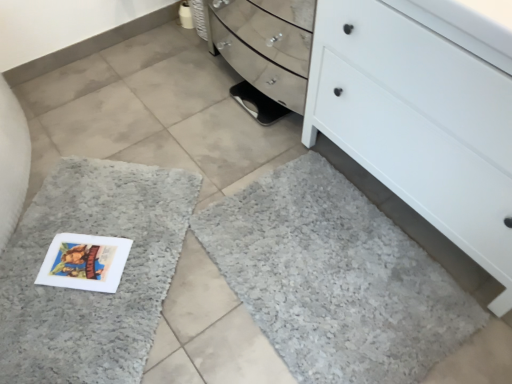
Where is `black rubber shoe at center`? Image resolution: width=512 pixels, height=384 pixels. black rubber shoe at center is located at coordinates pos(258,104).

The image size is (512, 384). Describe the element at coordinates (335, 278) in the screenshot. I see `gray shaggy bath mat at lower right, the second bath mat when ordered from left to right` at that location.

What are the coordinates of `gray shaggy bath mat at lower left, which is the second bath mat from right to left` in the screenshot? It's located at point(91,291).

Can you tell me how much gray shaggy bath mat at lower left, marked as the first bath mat in a left-to-right arrangement, and gray shaggy bath mat at lower right, the second bath mat when ordered from left to right, differ in facing direction?

gray shaggy bath mat at lower left, marked as the first bath mat in a left-to-right arrangement, and gray shaggy bath mat at lower right, the second bath mat when ordered from left to right, are facing 132 degrees away from each other.

Does point (180, 241) come behind point (349, 266)?

Yes, it is.

From the image's perspective, is gray shaggy bath mat at lower left, which is the second bath mat from right to left, above or below gray shaggy bath mat at lower right, the second bath mat when ordered from left to right?

From the image's perspective, gray shaggy bath mat at lower left, which is the second bath mat from right to left, appears above gray shaggy bath mat at lower right, the second bath mat when ordered from left to right.

Can you confirm if gray shaggy bath mat at lower left, marked as the first bath mat in a left-to-right arrangement, is taller than gray shaggy bath mat at lower right, the second bath mat when ordered from left to right?

Correct, gray shaggy bath mat at lower left, marked as the first bath mat in a left-to-right arrangement, is much taller as gray shaggy bath mat at lower right, the second bath mat when ordered from left to right.

Do you think gray shaggy bath mat at lower right, the second bath mat when ordered from left to right, is within gray shaggy bath mat at lower left, marked as the first bath mat in a left-to-right arrangement, or outside of it?

gray shaggy bath mat at lower right, the second bath mat when ordered from left to right, is not inside gray shaggy bath mat at lower left, marked as the first bath mat in a left-to-right arrangement, it's outside.

Is gray shaggy bath mat at lower right, the 1th bath mat viewed from the right, closer to the viewer compared to gray shaggy bath mat at lower left, marked as the first bath mat in a left-to-right arrangement?

That is True.

From the image's perspective, between gray shaggy bath mat at lower right, the second bath mat when ordered from left to right, and gray shaggy bath mat at lower left, which is the second bath mat from right to left, who is located below?

gray shaggy bath mat at lower right, the second bath mat when ordered from left to right, is shown below in the image.

Considering the points (419, 290) and (29, 299), which point is behind, point (419, 290) or point (29, 299)?

The point (419, 290) is behind.

From the image's perspective, is gray shaggy bath mat at lower left, which is the second bath mat from right to left, over white matte chest of drawers at lower right?

No.

Considering the relative sizes of gray shaggy bath mat at lower left, which is the second bath mat from right to left, and white matte chest of drawers at lower right in the image provided, is gray shaggy bath mat at lower left, which is the second bath mat from right to left, taller than white matte chest of drawers at lower right?

In fact, gray shaggy bath mat at lower left, which is the second bath mat from right to left, may be shorter than white matte chest of drawers at lower right.

Does gray shaggy bath mat at lower left, which is the second bath mat from right to left, have a greater width compared to white matte chest of drawers at lower right?

Yes.

Looking at this image, from a real-world perspective, relative to white matte chest of drawers at lower right, is gray shaggy bath mat at lower left, which is the second bath mat from right to left, vertically above or below?

From a real-world perspective, gray shaggy bath mat at lower left, which is the second bath mat from right to left, is physically below white matte chest of drawers at lower right.

Is white matte chest of drawers at lower right positioned with its back to gray shaggy bath mat at lower right, the second bath mat when ordered from left to right?

That's not correct — white matte chest of drawers at lower right is not looking away from gray shaggy bath mat at lower right, the second bath mat when ordered from left to right.

Based on their sizes in the image, would you say white matte chest of drawers at lower right is bigger or smaller than gray shaggy bath mat at lower right, the 1th bath mat viewed from the right?

In the image, white matte chest of drawers at lower right appears to be larger than gray shaggy bath mat at lower right, the 1th bath mat viewed from the right.

How far apart are white matte chest of drawers at lower right and gray shaggy bath mat at lower left, marked as the first bath mat in a left-to-right arrangement?

A distance of 36.10 inches exists between white matte chest of drawers at lower right and gray shaggy bath mat at lower left, marked as the first bath mat in a left-to-right arrangement.

Based on the photo, considering the sizes of objects white matte chest of drawers at lower right and gray shaggy bath mat at lower left, which is the second bath mat from right to left, in the image provided, who is bigger, white matte chest of drawers at lower right or gray shaggy bath mat at lower left, which is the second bath mat from right to left,?

With larger size is white matte chest of drawers at lower right.

Is white matte chest of drawers at lower right touching gray shaggy bath mat at lower left, which is the second bath mat from right to left?

No, white matte chest of drawers at lower right is not touching gray shaggy bath mat at lower left, which is the second bath mat from right to left.

Is white matte chest of drawers at lower right facing towards gray shaggy bath mat at lower left, marked as the first bath mat in a left-to-right arrangement?

Answer: Yes, white matte chest of drawers at lower right is turned towards gray shaggy bath mat at lower left, marked as the first bath mat in a left-to-right arrangement.

Considering the relative positions of white matte chest of drawers at lower right and black rubber shoe at center in the image provided, is white matte chest of drawers at lower right to the left or to the right of black rubber shoe at center?

white matte chest of drawers at lower right is positioned on black rubber shoe at center's right side.

The height and width of the screenshot is (384, 512). I want to click on the chest of drawers in front of the black rubber shoe at center, so pos(418,123).

Can you confirm if white matte chest of drawers at lower right is shorter than black rubber shoe at center?

In fact, white matte chest of drawers at lower right may be taller than black rubber shoe at center.

Is white matte chest of drawers at lower right inside or outside of black rubber shoe at center?

white matte chest of drawers at lower right exists outside the volume of black rubber shoe at center.

Is black rubber shoe at center at the back of gray shaggy bath mat at lower left, which is the second bath mat from right to left?

No, gray shaggy bath mat at lower left, which is the second bath mat from right to left,'s orientation is not away from black rubber shoe at center.

In the scene shown: From the image's perspective, between gray shaggy bath mat at lower left, marked as the first bath mat in a left-to-right arrangement, and black rubber shoe at center, which one is located above?

From the image's view, black rubber shoe at center is above.

Does gray shaggy bath mat at lower left, marked as the first bath mat in a left-to-right arrangement, touch black rubber shoe at center?

No, gray shaggy bath mat at lower left, marked as the first bath mat in a left-to-right arrangement, is not making contact with black rubber shoe at center.

Which is in front, point (61, 366) or point (249, 97)?

The point (61, 366) is closer to the camera.

Where is `bath mat behind the gray shaggy bath mat at lower right, the second bath mat when ordered from left to right`? Image resolution: width=512 pixels, height=384 pixels. bath mat behind the gray shaggy bath mat at lower right, the second bath mat when ordered from left to right is located at coordinates (91, 291).

Where is `bath mat that appears on the left of gray shaggy bath mat at lower right, the second bath mat when ordered from left to right`? bath mat that appears on the left of gray shaggy bath mat at lower right, the second bath mat when ordered from left to right is located at coordinates (91, 291).

When comparing their distances from gray shaggy bath mat at lower right, the 1th bath mat viewed from the right, does gray shaggy bath mat at lower left, marked as the first bath mat in a left-to-right arrangement, or black rubber shoe at center seem closer?

The object closer to gray shaggy bath mat at lower right, the 1th bath mat viewed from the right, is gray shaggy bath mat at lower left, marked as the first bath mat in a left-to-right arrangement.

From the image, which object appears to be nearer to gray shaggy bath mat at lower left, marked as the first bath mat in a left-to-right arrangement, black rubber shoe at center or gray shaggy bath mat at lower right, the second bath mat when ordered from left to right?

Among the two, gray shaggy bath mat at lower right, the second bath mat when ordered from left to right, is located nearer to gray shaggy bath mat at lower left, marked as the first bath mat in a left-to-right arrangement.

Estimate the real-world distances between objects in this image. Which object is closer to white matte chest of drawers at lower right, gray shaggy bath mat at lower right, the 1th bath mat viewed from the right, or gray shaggy bath mat at lower left, which is the second bath mat from right to left?

gray shaggy bath mat at lower right, the 1th bath mat viewed from the right, is positioned closer to the anchor white matte chest of drawers at lower right.

Based on their spatial positions, is gray shaggy bath mat at lower left, which is the second bath mat from right to left, or black rubber shoe at center closer to white matte chest of drawers at lower right?

The object closer to white matte chest of drawers at lower right is black rubber shoe at center.

Based on their spatial positions, is gray shaggy bath mat at lower left, marked as the first bath mat in a left-to-right arrangement, or gray shaggy bath mat at lower right, the second bath mat when ordered from left to right, closer to black rubber shoe at center?

gray shaggy bath mat at lower right, the second bath mat when ordered from left to right, lies closer to black rubber shoe at center than the other object.

Estimate the real-world distances between objects in this image. Which object is closer to black rubber shoe at center, gray shaggy bath mat at lower right, the second bath mat when ordered from left to right, or white matte chest of drawers at lower right?

Based on the image, white matte chest of drawers at lower right appears to be nearer to black rubber shoe at center.

When comparing their distances from black rubber shoe at center, does gray shaggy bath mat at lower right, the 1th bath mat viewed from the right, or gray shaggy bath mat at lower left, marked as the first bath mat in a left-to-right arrangement, seem closer?

Among the two, gray shaggy bath mat at lower right, the 1th bath mat viewed from the right, is located nearer to black rubber shoe at center.

Considering their positions, is black rubber shoe at center positioned closer to gray shaggy bath mat at lower right, the second bath mat when ordered from left to right, than white matte chest of drawers at lower right?

white matte chest of drawers at lower right lies closer to gray shaggy bath mat at lower right, the second bath mat when ordered from left to right, than the other object.

Find the location of a particular element. The width and height of the screenshot is (512, 384). bath mat between gray shaggy bath mat at lower left, marked as the first bath mat in a left-to-right arrangement, and white matte chest of drawers at lower right from left to right is located at coordinates (335, 278).

The image size is (512, 384). Find the location of `footwear situated between gray shaggy bath mat at lower left, which is the second bath mat from right to left, and white matte chest of drawers at lower right from left to right`. footwear situated between gray shaggy bath mat at lower left, which is the second bath mat from right to left, and white matte chest of drawers at lower right from left to right is located at coordinates (258, 104).

You are a GUI agent. You are given a task and a screenshot of the screen. Output one action in this format:
    pyautogui.click(x=<x>, y=<y>)
    Task: Click on the footwear situated between gray shaggy bath mat at lower left, marked as the first bath mat in a left-to-right arrangement, and gray shaggy bath mat at lower right, the 1th bath mat viewed from the right, from left to right
    Image resolution: width=512 pixels, height=384 pixels.
    Given the screenshot: What is the action you would take?
    pyautogui.click(x=258, y=104)